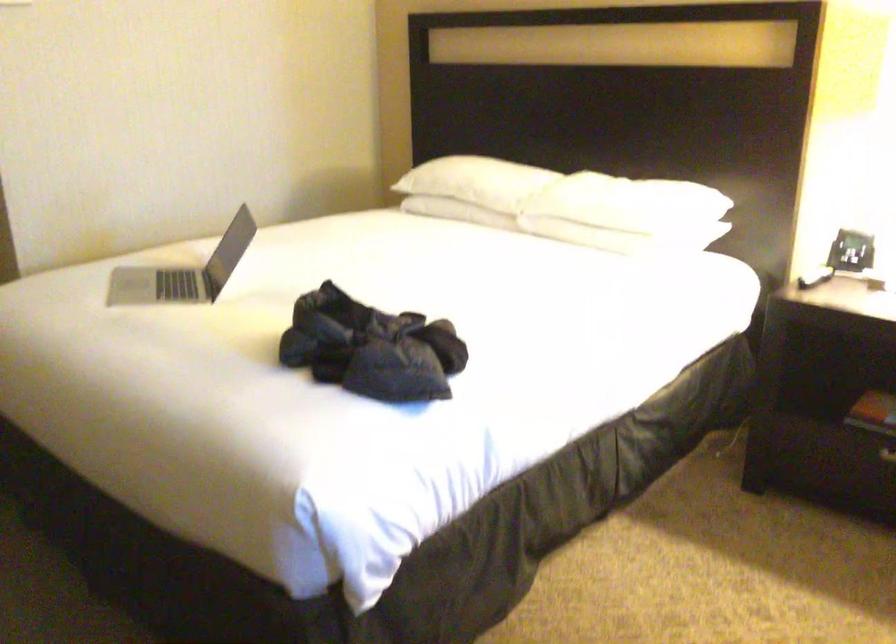
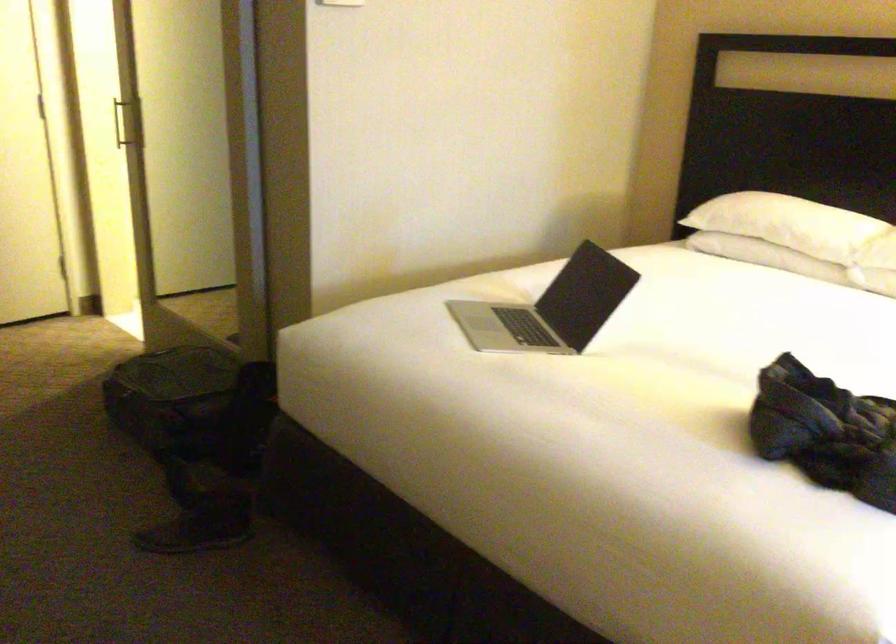
The point at (340, 346) is marked in the first image. Where is the corresponding point in the second image?

(825, 431)